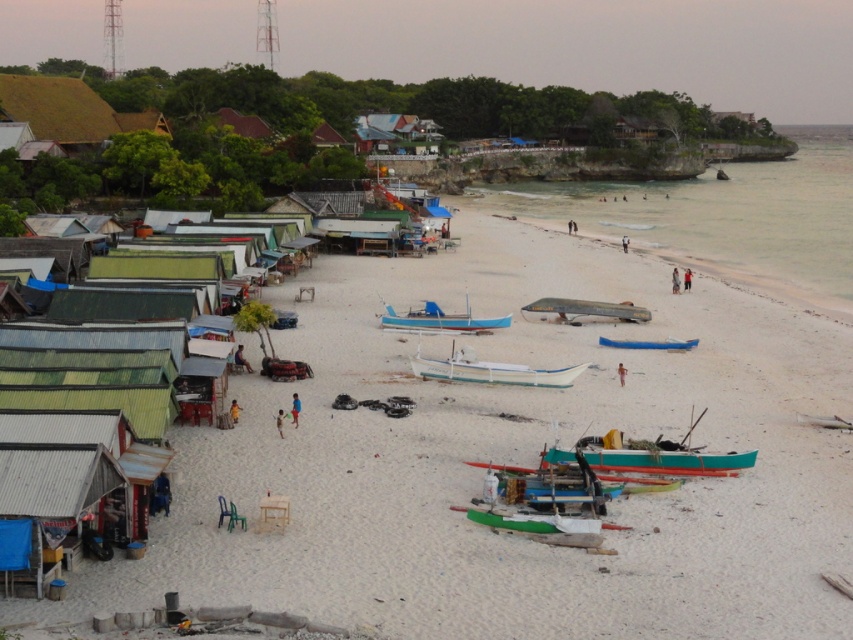
You are standing on the beach and want to find the clear water at beach right. According to the scene description, where should you look relative to your position?

The clear water at beach right is located at point 0.338 along the x axis and 0.850 along the y axis from the bottom left corner of the image.

You are standing on the shore and want to reach the white sandy beach at center. Which direction should you walk to get there?

The white sandy beach at center is located at point (512,464), so you should walk towards the center of the image to reach it.